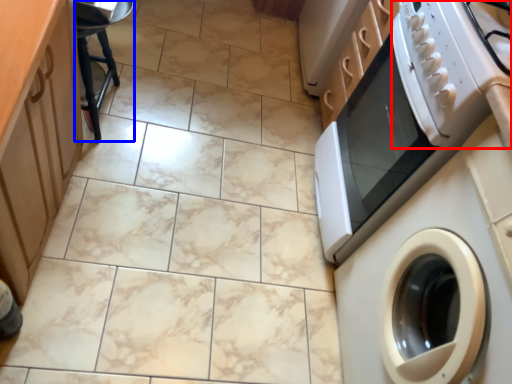
Question: Among these objects, which one is nearest to the camera, gas stove (highlighted by a red box) or bar stool (highlighted by a blue box)?

Choices:
 (A) gas stove
 (B) bar stool

Answer: (A)